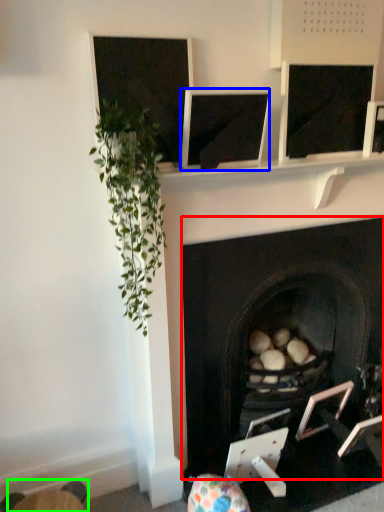
Question: Which object is positioned closest to fireplace (highlighted by a red box)? Select from computer screen (highlighted by a blue box) and swivel chair (highlighted by a green box).

Choices:
 (A) computer screen
 (B) swivel chair

Answer: (A)